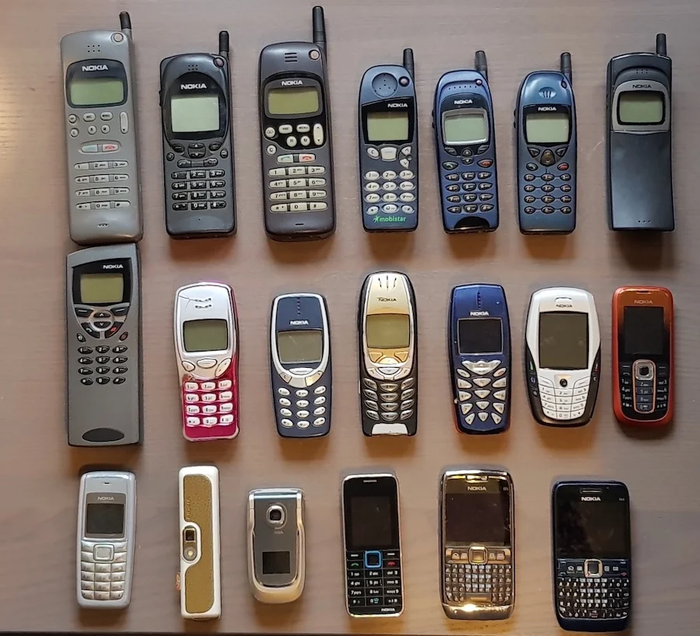
Where is `telephones in third row`? The image size is (700, 636). telephones in third row is located at coordinates (606, 558), (472, 558), (365, 572), (266, 558), (190, 574), (98, 549).